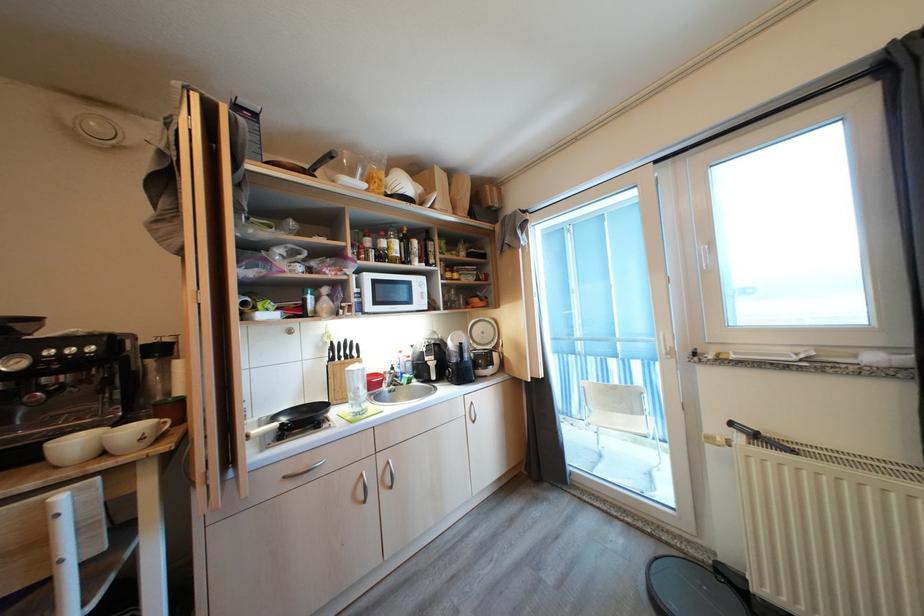
Image resolution: width=924 pixels, height=616 pixels. I want to click on black tool handle, so click(x=760, y=437).